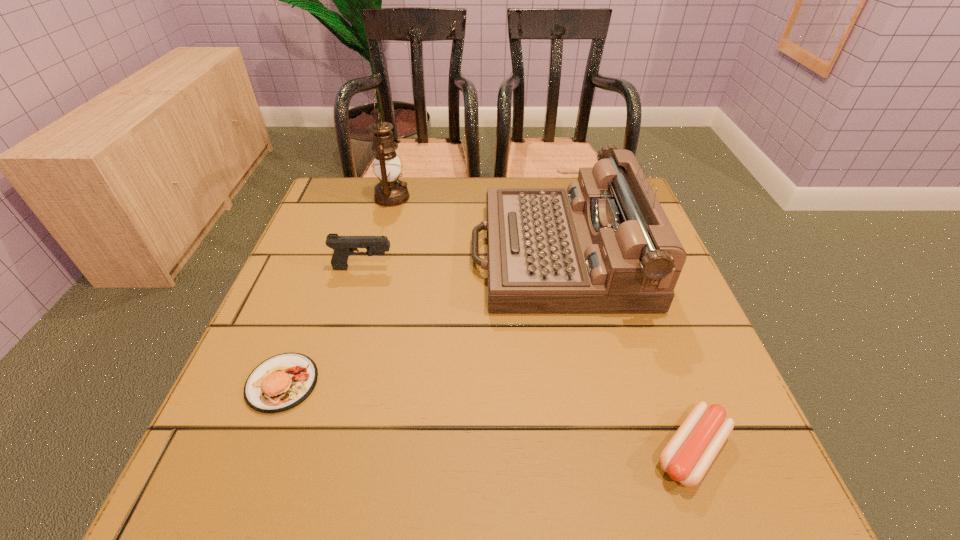
The height and width of the screenshot is (540, 960). What are the coordinates of `the tallest object` in the screenshot? It's located at (390, 192).

Identify the location of the second tallest object. The image size is (960, 540). (604, 245).

What are the coordinates of `pistol` in the screenshot? It's located at (344, 246).

Find the location of a particular element. the fourth tallest object is located at coordinates (281, 382).

You are a GUI agent. You are given a task and a screenshot of the screen. Output one action in this format:
    pyautogui.click(x=<x>, y=<y>)
    Task: Click on the sausage
    The height and width of the screenshot is (540, 960).
    Given the screenshot: What is the action you would take?
    (688, 455)

The width and height of the screenshot is (960, 540). Find the location of `vacant space situated on the front of the oil lamp`. vacant space situated on the front of the oil lamp is located at coordinates (363, 308).

Find the location of a particular element. Image resolution: width=960 pixels, height=540 pixels. vacant area located 0.120m on the keyboard of the typewriter is located at coordinates (419, 254).

You are a GUI agent. You are given a task and a screenshot of the screen. Output one action in this format:
    pyautogui.click(x=<x>, y=<y>)
    Task: Click on the vacant space situated 0.120m on the keyboard of the typewriter
    The image size is (960, 540).
    Given the screenshot: What is the action you would take?
    pyautogui.click(x=419, y=254)

This screenshot has width=960, height=540. In order to click on vacant space located 0.260m on the keyboard of the typewriter in this screenshot , I will do coord(356,254).

Identify the location of vacant region located 0.120m at the barrel of the third tallest object. The image size is (960, 540). (448, 268).